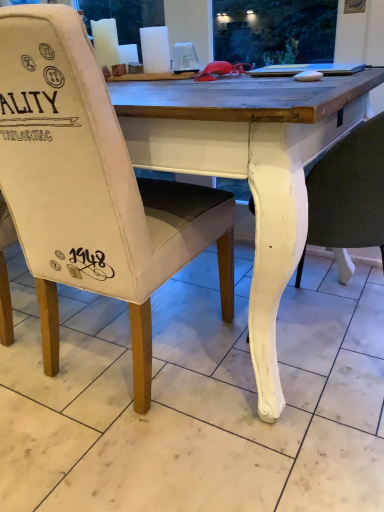
You are a GUI agent. You are given a task and a screenshot of the screen. Output one action in this format:
    pyautogui.click(x=<x>, y=<y>)
    Task: Click on the free point below canvas chair at center, acting as the first chair starting from the left (from a real-world perspective)
    Image resolution: width=384 pixels, height=512 pixels.
    Given the screenshot: What is the action you would take?
    pyautogui.click(x=152, y=354)